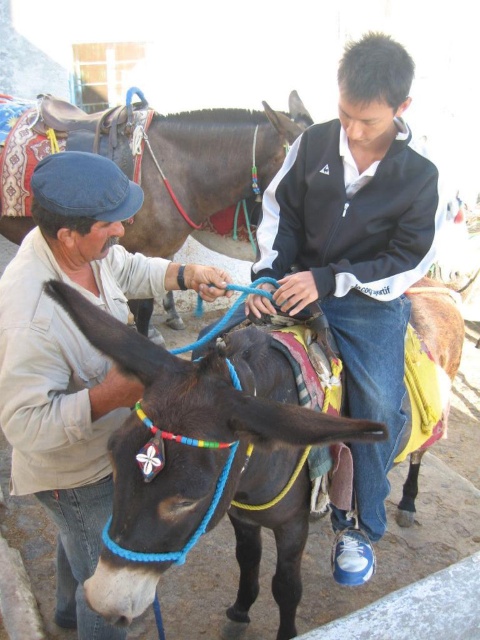
You are trying to find the black matte jacket at center in the image. According to the scene description, where would you look relative to the shiny black mule at center?

The black matte jacket at center is located below the shiny black mule at center.